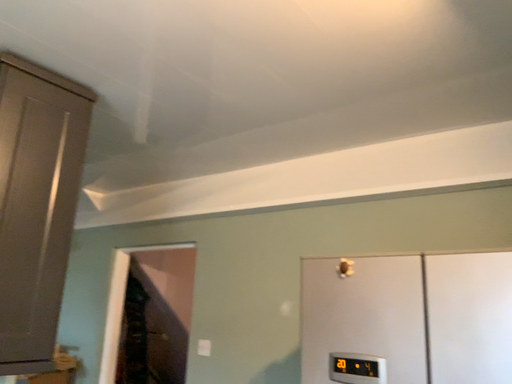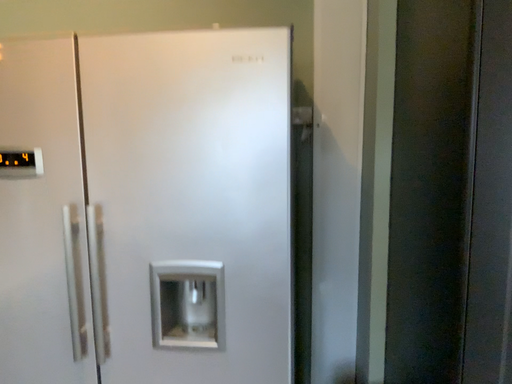
Question: Which way did the camera rotate in the video?

Choices:
 (A) rotated upward
 (B) rotated downward

Answer: (B)